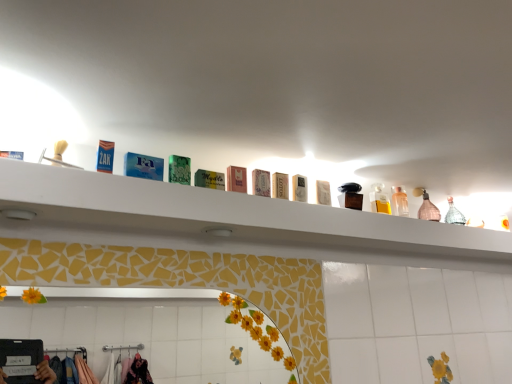
The height and width of the screenshot is (384, 512). What do you see at coordinates (209, 179) in the screenshot?
I see `green matte soap at center, positioned as the seventh toiletry in right-to-left order` at bounding box center [209, 179].

The width and height of the screenshot is (512, 384). What do you see at coordinates (298, 188) in the screenshot?
I see `white matte soap at center, which is the sixth toiletry from front to back` at bounding box center [298, 188].

Locate an element on the screen. The width and height of the screenshot is (512, 384). blue cardboard box at upper left, the eighth toiletry from the right is located at coordinates (105, 156).

Between point (396, 208) and point (324, 196), which one is positioned in front?

The point (324, 196) is closer.

Between clear plastic bottle at upper right, the 1th toiletry positioned from the right, and white matte soap at center, the 2th toiletry when ordered from back to front, which one appears on the right side from the viewer's perspective?

clear plastic bottle at upper right, the 1th toiletry positioned from the right, is more to the right.

Measure the distance between clear plastic bottle at upper right, the 8th toiletry positioned from the front, and white matte soap at center, arranged as the 7th toiletry when viewed from the front.

13.03 inches.

Does clear plastic bottle at upper right, the 8th toiletry positioned from the front, have a greater height compared to white matte soap at center, arranged as the 7th toiletry when viewed from the front?

Correct, clear plastic bottle at upper right, the 8th toiletry positioned from the front, is much taller as white matte soap at center, arranged as the 7th toiletry when viewed from the front.

Which is correct: blue cardboard box at upper left, marked as the first toiletry in a left-to-right arrangement, is inside pink glass bottle at upper right, or outside of it?

blue cardboard box at upper left, marked as the first toiletry in a left-to-right arrangement, is spatially situated outside pink glass bottle at upper right.

Between blue cardboard box at upper left, arranged as the first toiletry when viewed from the front, and pink glass bottle at upper right, which one has larger size?

pink glass bottle at upper right.

Between blue cardboard box at upper left, arranged as the first toiletry when viewed from the front, and pink glass bottle at upper right, which one has less height?

blue cardboard box at upper left, arranged as the first toiletry when viewed from the front.

This screenshot has height=384, width=512. In order to click on toiletry lying on the left of green matte soap at center, positioned as the seventh toiletry in right-to-left order in this screenshot , I will do `click(105, 156)`.

Looking at this image, is blue cardboard box at upper left, the eighth toiletry from the right, oriented away from green matte soap at center, positioned as the seventh toiletry in right-to-left order?

No, blue cardboard box at upper left, the eighth toiletry from the right, is not facing away from green matte soap at center, positioned as the seventh toiletry in right-to-left order.

In the image, is blue cardboard box at upper left, marked as the first toiletry in a left-to-right arrangement, positioned in front of or behind green matte soap at center, the 2th toiletry in the front-to-back sequence?

Clearly, blue cardboard box at upper left, marked as the first toiletry in a left-to-right arrangement, is in front of green matte soap at center, the 2th toiletry in the front-to-back sequence.

Considering the sizes of objects white matte soap at center, marked as the 4th toiletry in a right-to-left arrangement, and white matte soap at center, the 2th toiletry when ordered from back to front, in the image provided, who is thinner, white matte soap at center, marked as the 4th toiletry in a right-to-left arrangement, or white matte soap at center, the 2th toiletry when ordered from back to front,?

white matte soap at center, marked as the 4th toiletry in a right-to-left arrangement.

Does point (282, 198) lie behind point (320, 184)?

No, it is in front of (320, 184).

Considering their positions, is white matte soap at center, which is the fifth toiletry from left to right, located in front of or behind white matte soap at center, the 2th toiletry when ordered from back to front?

white matte soap at center, which is the fifth toiletry from left to right, is positioned closer to the viewer than white matte soap at center, the 2th toiletry when ordered from back to front.

Is white cardboard box at center, the 4th toiletry positioned from the left, oriented towards green matte soap at center, positioned as the seventh toiletry in back-to-front order?

No, white cardboard box at center, the 4th toiletry positioned from the left, is not aimed at green matte soap at center, positioned as the seventh toiletry in back-to-front order.

Consider the image. From a real-world perspective, which is physically above, white cardboard box at center, the 4th toiletry positioned from the left, or green matte soap at center, positioned as the seventh toiletry in back-to-front order?

white cardboard box at center, the 4th toiletry positioned from the left.

Which is correct: white cardboard box at center, the fifth toiletry viewed from the back, is inside green matte soap at center, the 2th toiletry in the front-to-back sequence, or outside of it?

white cardboard box at center, the fifth toiletry viewed from the back, is not inside green matte soap at center, the 2th toiletry in the front-to-back sequence, it's outside.

From the image's perspective, does white cardboard box at center, the fifth toiletry viewed from the back, appear lower than green matte soap at center, positioned as the seventh toiletry in back-to-front order?

Yes, from the image's perspective, white cardboard box at center, the fifth toiletry viewed from the back, is beneath green matte soap at center, positioned as the seventh toiletry in back-to-front order.

What's the angular difference between white cardboard box at center, acting as the 4th toiletry starting from the front, and white matte soap at center, marked as the 5th toiletry in a front-to-back arrangement,'s facing directions?

The facing directions of white cardboard box at center, acting as the 4th toiletry starting from the front, and white matte soap at center, marked as the 5th toiletry in a front-to-back arrangement, are 1.24 degrees apart.

Between white cardboard box at center, the fifth toiletry viewed from the back, and white matte soap at center, marked as the 4th toiletry in a right-to-left arrangement, which one has smaller width?

white cardboard box at center, the fifth toiletry viewed from the back, is thinner.

Is point (266, 178) positioned before point (285, 189)?

Yes, it is in front of point (285, 189).

Is white cardboard box at center, positioned as the fifth toiletry in right-to-left order, oriented away from white matte soap at center, marked as the 4th toiletry in a right-to-left arrangement?

No, white cardboard box at center, positioned as the fifth toiletry in right-to-left order, is not facing away from white matte soap at center, marked as the 4th toiletry in a right-to-left arrangement.

Is clear plastic bottle at upper center positioned beyond the bounds of white matte soap at center, which is the 3th toiletry from right to left?

Absolutely, clear plastic bottle at upper center is external to white matte soap at center, which is the 3th toiletry from right to left.

Between clear plastic bottle at upper center and white matte soap at center, arranged as the 6th toiletry when viewed from the left, which one has less height?

white matte soap at center, arranged as the 6th toiletry when viewed from the left, is shorter.

From the image's perspective, is clear plastic bottle at upper center positioned above or below white matte soap at center, arranged as the 6th toiletry when viewed from the left?

Based on their image positions, clear plastic bottle at upper center is located beneath white matte soap at center, arranged as the 6th toiletry when viewed from the left.

What are the coordinates of `toiletry below the white matte soap at center, the 2th toiletry when ordered from back to front (from the image's perspective)` in the screenshot? It's located at tap(400, 203).

Image resolution: width=512 pixels, height=384 pixels. What are the coordinates of `the 8th toiletry in front of the pink glass bottle at upper right, counting from the anchor's position` in the screenshot? It's located at (105, 156).

From the image, which object appears to be nearer to white cardboard box at center, the fifth toiletry viewed from the back, white matte soap at center, the 3th toiletry when ordered from back to front, or white matte soap at center, the 2th toiletry when ordered from back to front?

white matte soap at center, the 3th toiletry when ordered from back to front, is closer to white cardboard box at center, the fifth toiletry viewed from the back.

Estimate the real-world distances between objects in this image. Which object is further from pink glass bottle at upper right, green matte soap at center, the 2th toiletry in the front-to-back sequence, or white matte soap at center, marked as the 5th toiletry in a front-to-back arrangement?

Among the two, green matte soap at center, the 2th toiletry in the front-to-back sequence, is located further to pink glass bottle at upper right.

Estimate the real-world distances between objects in this image. Which object is further from white matte soap at center, marked as the 4th toiletry in a right-to-left arrangement, green matte soap at center, positioned as the seventh toiletry in right-to-left order, or clear plastic bottle at upper right, the 1th toiletry positioned from the right?

Based on the image, clear plastic bottle at upper right, the 1th toiletry positioned from the right, appears to be further to white matte soap at center, marked as the 4th toiletry in a right-to-left arrangement.

Looking at the image, which one is located closer to clear plastic bottle at upper right, the 8th toiletry positioned from the front, pink glass bottle at upper right or white matte shelf at upper center?

pink glass bottle at upper right is closer to clear plastic bottle at upper right, the 8th toiletry positioned from the front.

Estimate the real-world distances between objects in this image. Which object is closer to white matte soap at center, which is the 3th toiletry from right to left, white matte soap at center, the 2th toiletry when ordered from back to front, or pink glass bottle at upper right?

white matte soap at center, the 2th toiletry when ordered from back to front.

Estimate the real-world distances between objects in this image. Which object is further from pink glass bottle at upper right, white matte shelf at upper center or white cardboard box at center, acting as the 4th toiletry starting from the front?

white cardboard box at center, acting as the 4th toiletry starting from the front.

Considering their positions, is white matte soap at center, marked as the 5th toiletry in a front-to-back arrangement, positioned further to clear plastic bottle at upper right, the 8th toiletry positioned from the front, than clear plastic bottle at upper center?

Among the two, white matte soap at center, marked as the 5th toiletry in a front-to-back arrangement, is located further to clear plastic bottle at upper right, the 8th toiletry positioned from the front.

When comparing their distances from pink glass bottle at upper right, does white matte soap at center, marked as the 4th toiletry in a right-to-left arrangement, or white matte shelf at upper center seem closer?

white matte shelf at upper center is closer to pink glass bottle at upper right.

The height and width of the screenshot is (384, 512). I want to click on toiletry situated between clear plastic bottle at upper center and pink glass bottle at upper right from left to right, so click(x=400, y=203).

Locate an element on the screen. The image size is (512, 384). toiletry located between white matte soap at center, which is the fifth toiletry from left to right, and white matte soap at center, acting as the 2th toiletry starting from the right, in the left-right direction is located at coordinates (298, 188).

Find the location of a particular element. This screenshot has height=384, width=512. toiletry situated between blue cardboard box at upper left, marked as the first toiletry in a left-to-right arrangement, and matte pink soap at center, which is the 3th toiletry from left to right, from left to right is located at coordinates (209, 179).

Where is `mouthwash between white matte soap at center, the seventh toiletry positioned from the left, and clear plastic bottle at upper right, which appears as the first toiletry when viewed from the back, in the horizontal direction`? mouthwash between white matte soap at center, the seventh toiletry positioned from the left, and clear plastic bottle at upper right, which appears as the first toiletry when viewed from the back, in the horizontal direction is located at coordinates (379, 201).